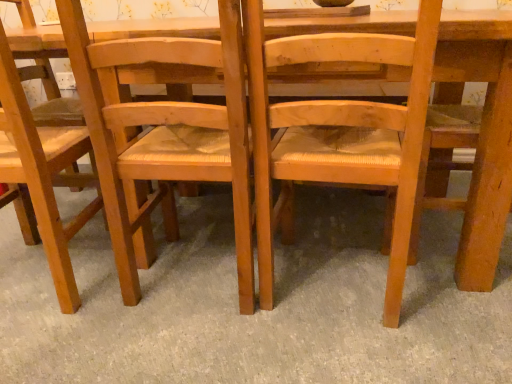
Question: Which direction should I rotate to look at natural wood chair at center, the third chair viewed from the left, — up or down?

Choices:
 (A) up
 (B) down

Answer: (A)

Question: Is wooden woven seat at center, the second chair in the left-to-right sequence, at the back of natural wood chair at center, which ranks as the first chair in right-to-left order?

Choices:
 (A) yes
 (B) no

Answer: (B)

Question: Can you confirm if natural wood chair at center, the third chair viewed from the left, is bigger than wooden woven seat at center, the 2th chair when ordered from right to left?

Choices:
 (A) yes
 (B) no

Answer: (B)

Question: Is natural wood chair at center, the third chair viewed from the left, closer to the viewer compared to wooden woven seat at center, the second chair in the left-to-right sequence?

Choices:
 (A) yes
 (B) no

Answer: (A)

Question: Does natural wood chair at center, the third chair viewed from the left, have a greater height compared to wooden woven seat at center, the second chair in the left-to-right sequence?

Choices:
 (A) yes
 (B) no

Answer: (B)

Question: Can you confirm if natural wood chair at center, which ranks as the first chair in right-to-left order, is thinner than wooden woven seat at center, the second chair in the left-to-right sequence?

Choices:
 (A) no
 (B) yes

Answer: (B)

Question: From a real-world perspective, is natural wood chair at center, which ranks as the first chair in right-to-left order, located beneath wooden woven seat at center, the 2th chair when ordered from right to left?

Choices:
 (A) yes
 (B) no

Answer: (A)

Question: Is light brown wood chair at left, which ranks as the 1th chair in left-to-right order, further to camera compared to wooden woven seat at center, the 2th chair when ordered from right to left?

Choices:
 (A) yes
 (B) no

Answer: (A)

Question: Is light brown wood chair at left, which ranks as the 1th chair in left-to-right order, in front of wooden woven seat at center, the second chair in the left-to-right sequence?

Choices:
 (A) no
 (B) yes

Answer: (A)

Question: Is light brown wood chair at left, arranged as the 3th chair when viewed from the right, taller than wooden woven seat at center, the 2th chair when ordered from right to left?

Choices:
 (A) yes
 (B) no

Answer: (A)

Question: Is light brown wood chair at left, arranged as the 3th chair when viewed from the right, to the right of wooden woven seat at center, the second chair in the left-to-right sequence, from the viewer's perspective?

Choices:
 (A) no
 (B) yes

Answer: (A)

Question: Is light brown wood chair at left, which ranks as the 1th chair in left-to-right order, not near wooden woven seat at center, the second chair in the left-to-right sequence?

Choices:
 (A) no
 (B) yes

Answer: (A)

Question: Is light brown wood chair at left, which ranks as the 1th chair in left-to-right order, bigger than wooden woven seat at center, the 2th chair when ordered from right to left?

Choices:
 (A) yes
 (B) no

Answer: (A)

Question: From a real-world perspective, does natural wood chair at center, the third chair viewed from the left, stand above light brown wood chair at left, arranged as the 3th chair when viewed from the right?

Choices:
 (A) no
 (B) yes

Answer: (A)